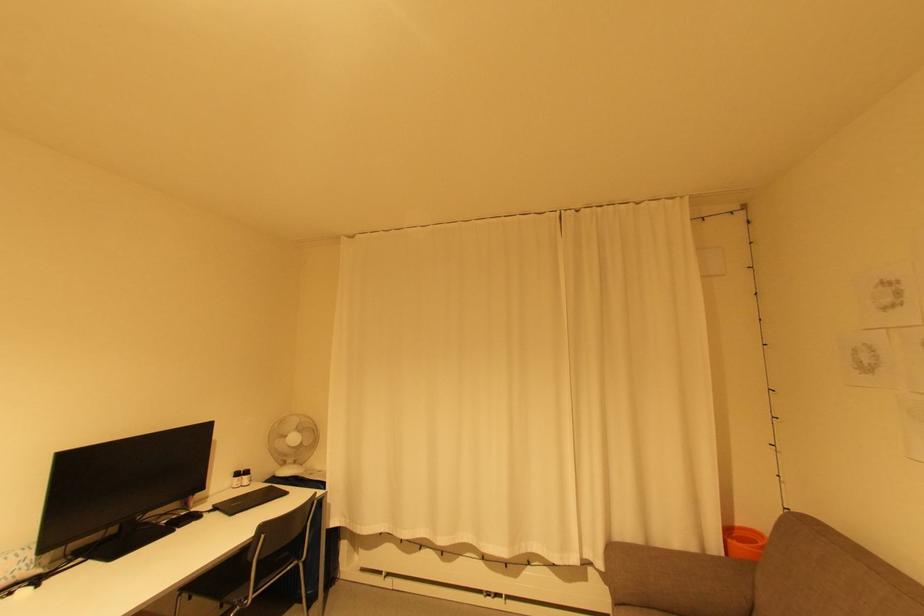
Describe the element at coordinates (568, 573) in the screenshot. I see `a white curtain edge` at that location.